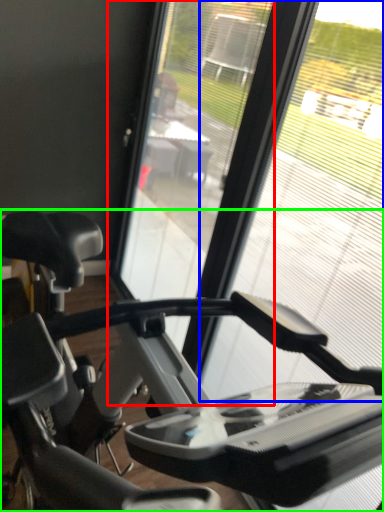
Question: Which object is positioned farthest from screen door (highlighted by a red box)? Select from glass window (highlighted by a blue box) and stationary bicycle (highlighted by a green box).

Choices:
 (A) glass window
 (B) stationary bicycle

Answer: (B)